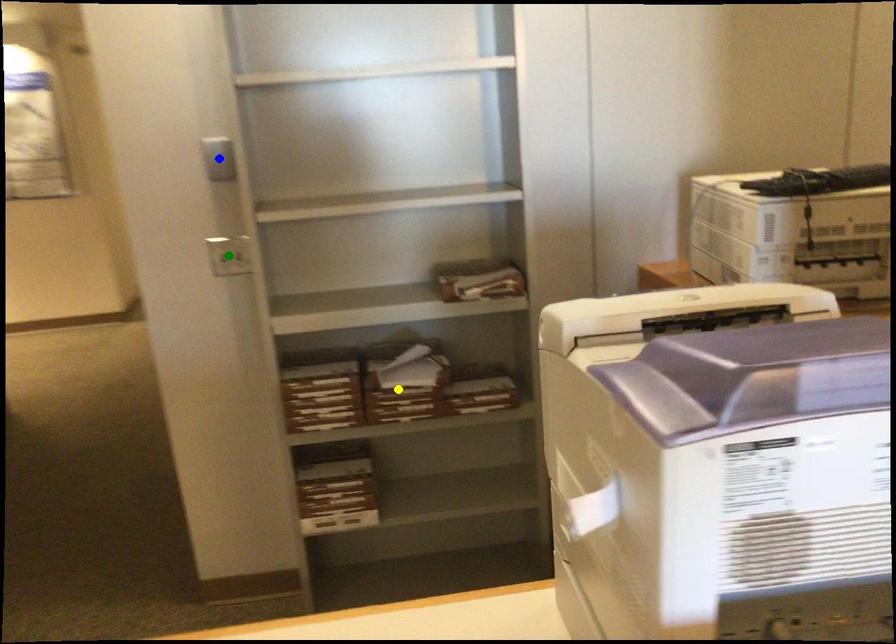
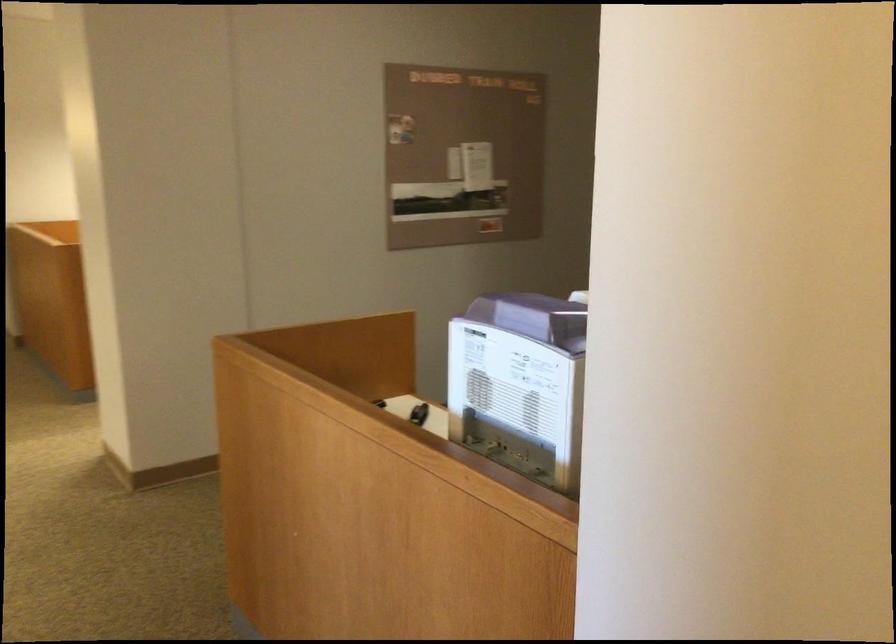
I am providing you with two images of the same scene from different viewpoints. Three points are marked in image1. Which point corresponds to a part or object that is occluded in image2?In image1, three points are marked. Which of them correspond to a part or object that is occluded in image2?Among the three points shown in image1, which one corresponds to a part or object that is no longer visible due to occlusion in image2?

blue point, green point, yellow point cannot be seen in image2.